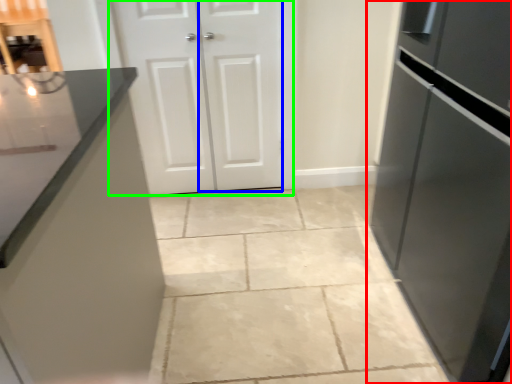
Question: Which object is the closest to the refrigerator (highlighted by a red box)? Choose among these: door (highlighted by a blue box) or door (highlighted by a green box).

Choices:
 (A) door
 (B) door

Answer: (A)